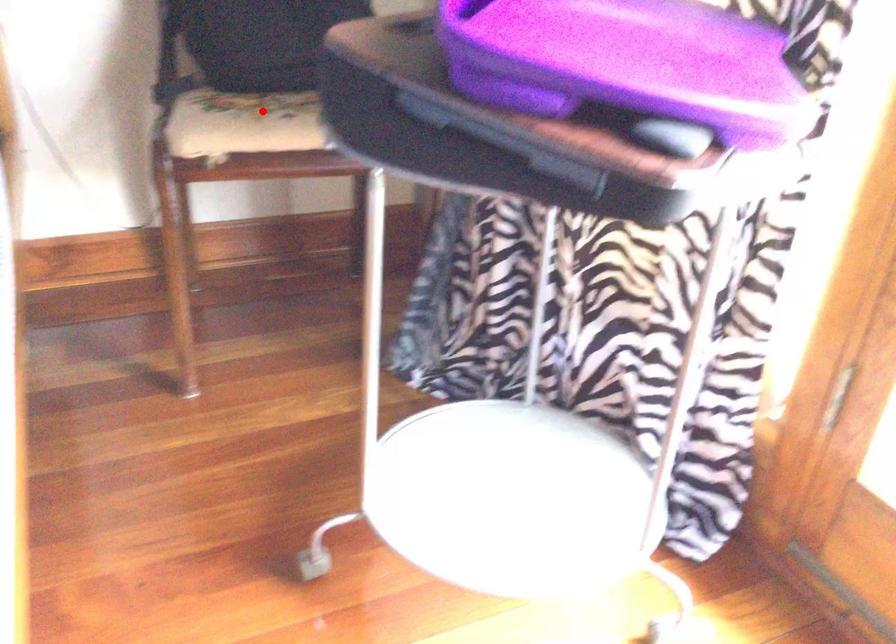
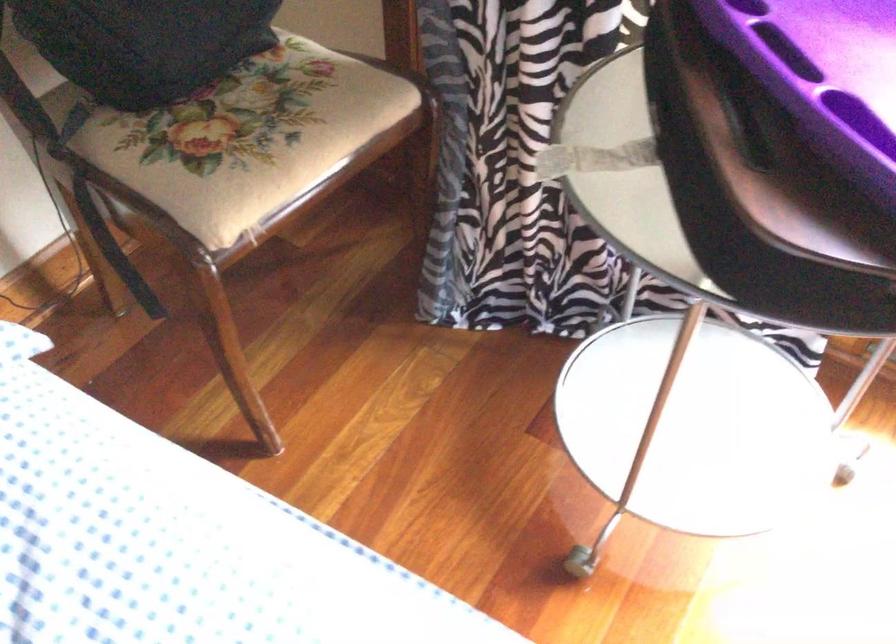
The point at the highlighted location is marked in the first image. Where is the corresponding point in the second image?

(259, 145)